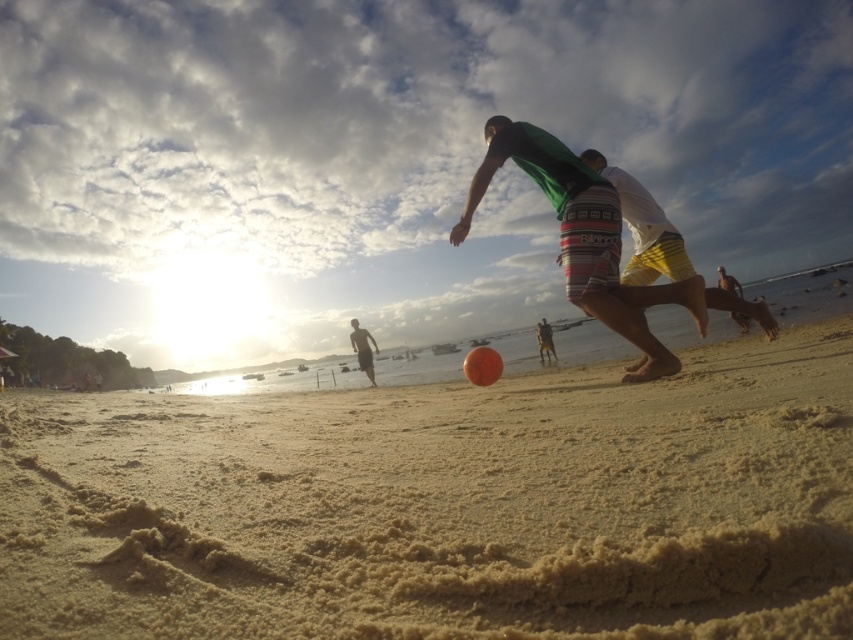
You are a photographer trying to capture a candid shot of the two people playing on the beach. You notice both the green striped shorts at center and the green fabric shirt at center. Which piece of clothing should you focus on to ensure it appears larger in your photo?

The green striped shorts at center is bigger than the green fabric shirt at center, so focusing on the green striped shorts at center will ensure it appears larger in the photo.

You are a photographer trying to capture the perfect shot of the sandy yellow at center and the green fabric shirt at center. Based on their positions, which object is closer to the camera?

The green fabric shirt at center is closer to the camera because the sandy yellow at center is positioned under it.